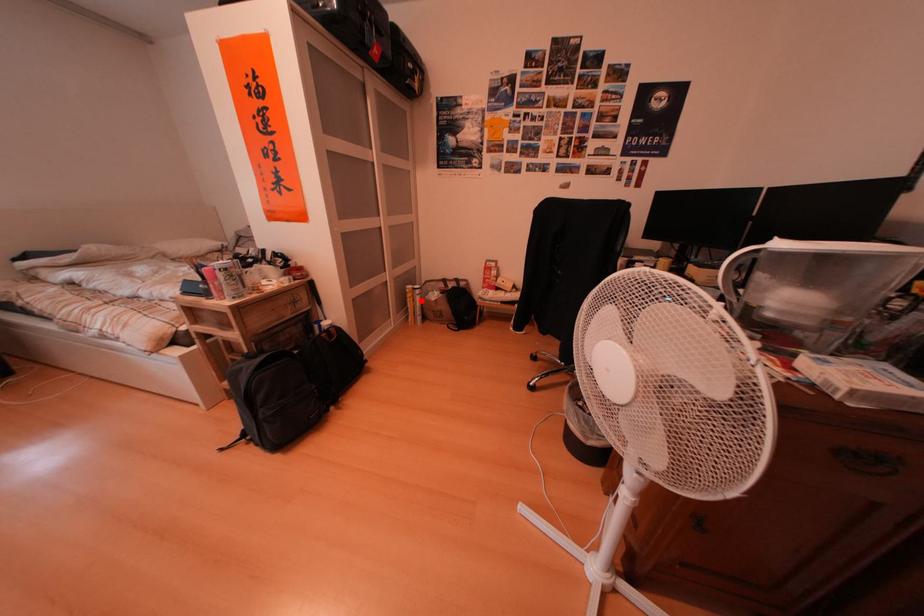
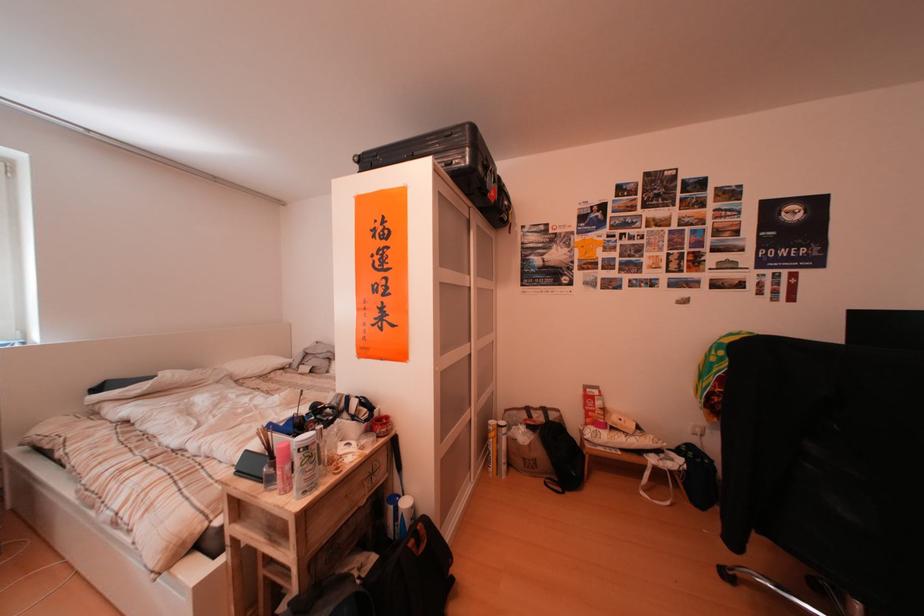
Question: I am providing you with two images of the same scene from different viewpoints. A red point is marked on the first image. Can you still see the location of the red point in image 2?

Choices:
 (A) Yes
 (B) No

Answer: (A)